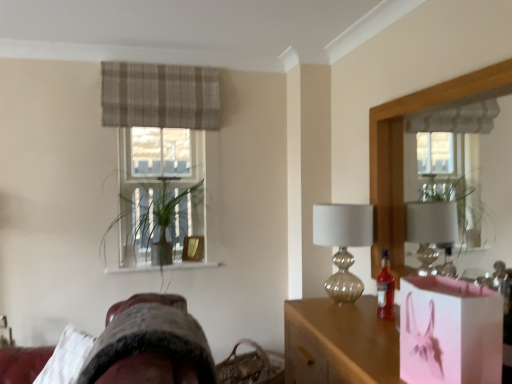
In order to click on pink glossy bag at center in this screenshot , I will do `click(339, 343)`.

Describe the element at coordinates (403, 151) in the screenshot. I see `wooden frame mirror at right` at that location.

What do you see at coordinates (151, 361) in the screenshot? The image size is (512, 384). I see `velvet-like brown swivel chair at lower left` at bounding box center [151, 361].

Image resolution: width=512 pixels, height=384 pixels. Find the location of `green leafy plant at center`. green leafy plant at center is located at coordinates (158, 220).

Locate an element on the screen. This screenshot has width=512, height=384. pink glossy bag at center is located at coordinates (339, 343).

From a real-world perspective, is plaid fabric curtain at upper center positioned above or below translucent glass bottle at right?

In terms of real-world spatial position, plaid fabric curtain at upper center is above translucent glass bottle at right.

I want to click on bottle in front of the plaid fabric curtain at upper center, so click(x=385, y=289).

Considering the relative sizes of plaid fabric curtain at upper center and translucent glass bottle at right in the image provided, is plaid fabric curtain at upper center bigger than translucent glass bottle at right?

Yes, plaid fabric curtain at upper center is bigger than translucent glass bottle at right.

Is plaid fabric curtain at upper center not near translucent glass bottle at right?

Yes, plaid fabric curtain at upper center is far from translucent glass bottle at right.

The image size is (512, 384). What are the coordinates of `mirror lying in front of the green leafy plant at center` in the screenshot? It's located at (403, 151).

Consider the image. How many degrees apart are the facing directions of green leafy plant at center and wooden frame mirror at right?

green leafy plant at center and wooden frame mirror at right are facing 90.1 degrees away from each other.

Between green leafy plant at center and wooden frame mirror at right, which one appears on the left side from the viewer's perspective?

Positioned to the left is green leafy plant at center.

Is green leafy plant at center wider than wooden frame mirror at right?

Correct, the width of green leafy plant at center exceeds that of wooden frame mirror at right.

Is green leafy plant at center not near pink paper bag at lower right?

Yes, green leafy plant at center and pink paper bag at lower right are located far from each other.

Would you say green leafy plant at center is outside pink paper bag at lower right?

Yes, green leafy plant at center is located beyond the bounds of pink paper bag at lower right.

From the image's perspective, does green leafy plant at center appear higher than pink paper bag at lower right?

Correct, green leafy plant at center appears higher than pink paper bag at lower right in the image.

Could you tell me if green leafy plant at center is facing pink paper bag at lower right?

Yes, green leafy plant at center faces towards pink paper bag at lower right.

Is velvet-like brown swivel chair at lower left next to woven brown basket at lower center and touching it?

No, velvet-like brown swivel chair at lower left is not in contact with woven brown basket at lower center.

Choose the correct answer: Is velvet-like brown swivel chair at lower left inside woven brown basket at lower center or outside it?

velvet-like brown swivel chair at lower left lies outside woven brown basket at lower center.

From the image's perspective, relative to woven brown basket at lower center, is velvet-like brown swivel chair at lower left above or below?

velvet-like brown swivel chair at lower left is above woven brown basket at lower center.

Between velvet-like brown swivel chair at lower left and woven brown basket at lower center, which one has larger width?

Wider between the two is velvet-like brown swivel chair at lower left.

Between pink glossy bag at center and woven brown basket at lower center, which one has more height?

pink glossy bag at center.

Is pink glossy bag at center wider or thinner than woven brown basket at lower center?

In the image, pink glossy bag at center appears to be wider than woven brown basket at lower center.

Is point (324, 302) behind point (231, 352)?

No, it is in front of (231, 352).

In order to click on basket that appears on the left of pink glossy bag at center in this screenshot , I will do `click(251, 366)`.

Consider the image. Which is further, (339, 232) or (241, 360)?

The point (241, 360) is farther from the camera.

Is translucent glass table lamp at center right turned away from woven brown basket at lower center?

That's not correct — translucent glass table lamp at center right is not looking away from woven brown basket at lower center.

Is translucent glass table lamp at center right surrounding woven brown basket at lower center?

No, woven brown basket at lower center is not inside translucent glass table lamp at center right.

Can you tell me how much translucent glass table lamp at center right and woven brown basket at lower center differ in facing direction?

32.9 degrees separate the facing orientations of translucent glass table lamp at center right and woven brown basket at lower center.

Which object is wider, wooden frame mirror at right or woven brown basket at lower center?

Wider between the two is woven brown basket at lower center.

Which point is more forward, (374, 234) or (260, 376)?

Point (374, 234)

From a real-world perspective, is wooden frame mirror at right over woven brown basket at lower center?

Yes, from a real-world perspective, wooden frame mirror at right is above woven brown basket at lower center.

Locate an element on the screen. The image size is (512, 384). mirror above the woven brown basket at lower center (from the image's perspective) is located at coordinates (403, 151).

Identify the location of curtain lying on the left of translucent glass bottle at right. (159, 96).

Locate an element on the screen. This screenshot has width=512, height=384. mirror on the right of green leafy plant at center is located at coordinates (403, 151).

From the image, which object appears to be nearer to woven brown basket at lower center, plaid fabric curtain at upper center or pink glossy bag at center?

pink glossy bag at center lies closer to woven brown basket at lower center than the other object.

Looking at this image, looking at the image, which one is located further to woven brown basket at lower center, translucent glass table lamp at center right or plaid fabric curtain at upper center?

Based on the image, plaid fabric curtain at upper center appears to be further to woven brown basket at lower center.

From the image, which object appears to be nearer to velvet-like brown swivel chair at lower left, wooden frame mirror at right or translucent glass bottle at right?

translucent glass bottle at right.

From the image, which object appears to be nearer to translucent glass table lamp at center right, woven brown basket at lower center or pink glossy bag at center?

pink glossy bag at center.

Looking at the image, which one is located closer to woven brown basket at lower center, green leafy plant at center or plaid fabric curtain at upper center?

Among the two, green leafy plant at center is located nearer to woven brown basket at lower center.

When comparing their distances from green leafy plant at center, does pink glossy bag at center or woven brown basket at lower center seem further?

Among the two, pink glossy bag at center is located further to green leafy plant at center.

Looking at the image, which one is located closer to woven brown basket at lower center, wooden frame mirror at right or plaid fabric curtain at upper center?

The object closer to woven brown basket at lower center is wooden frame mirror at right.

Which object lies further to the anchor point woven brown basket at lower center, green leafy plant at center or translucent glass bottle at right?

translucent glass bottle at right is positioned further to the anchor woven brown basket at lower center.

You are a GUI agent. You are given a task and a screenshot of the screen. Output one action in this format:
    pyautogui.click(x=<x>, y=<y>)
    Task: Click on the mirror between pink paper bag at lower right and green leafy plant at center in the front-back direction
    This screenshot has width=512, height=384.
    Given the screenshot: What is the action you would take?
    pyautogui.click(x=403, y=151)

At what (x,y) coordinates should I click in order to perform the action: click on mirror located between pink paper bag at lower right and translucent glass table lamp at center right in the depth direction. Please return your answer as a coordinate pair (x, y). Looking at the image, I should click on (403, 151).

Where is `table between pink paper bag at lower right and woven brown basket at lower center in the front-back direction`? Image resolution: width=512 pixels, height=384 pixels. table between pink paper bag at lower right and woven brown basket at lower center in the front-back direction is located at coordinates (339, 343).

Where is `table between plaid fabric curtain at upper center and woven brown basket at lower center vertically`? This screenshot has width=512, height=384. table between plaid fabric curtain at upper center and woven brown basket at lower center vertically is located at coordinates (339, 343).